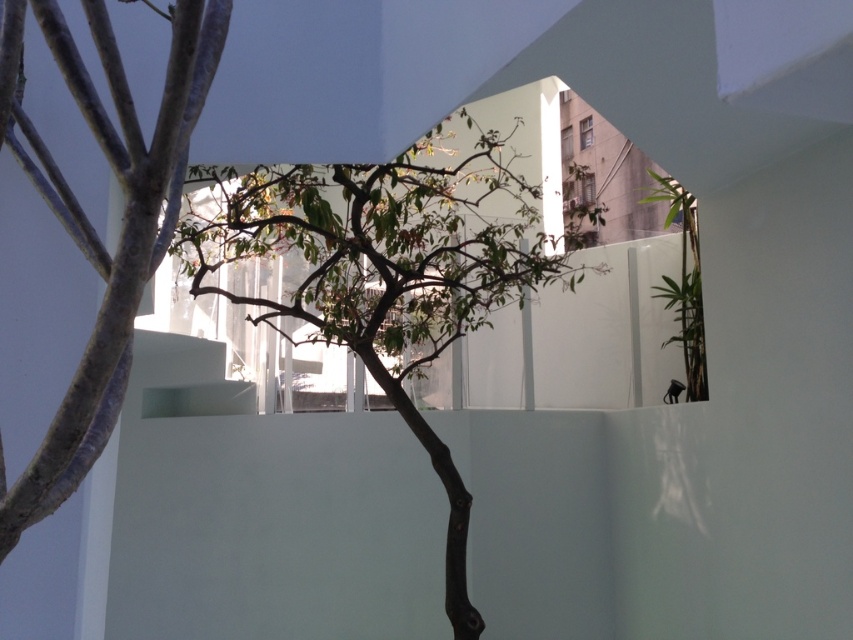
Who is more forward, (225,237) or (695,240)?

Point (225,237) is more forward.

You are a GUI agent. You are given a task and a screenshot of the screen. Output one action in this format:
    pyautogui.click(x=<x>, y=<y>)
    Task: Click on the green leafy tree at center
    The width and height of the screenshot is (853, 640).
    Given the screenshot: What is the action you would take?
    pyautogui.click(x=383, y=273)

Is green leafy tree at left wider than green leafy plant at right?

Indeed, green leafy tree at left has a greater width compared to green leafy plant at right.

Measure the distance between point [178,173] and camera.

A distance of 2.49 meters exists between point [178,173] and camera.

You are a GUI agent. You are given a task and a screenshot of the screen. Output one action in this format:
    pyautogui.click(x=<x>, y=<y>)
    Task: Click on the green leafy tree at left
    This screenshot has width=853, height=640.
    Given the screenshot: What is the action you would take?
    pyautogui.click(x=91, y=225)

Can you confirm if green leafy tree at center is positioned above green leafy tree at left?

Incorrect, green leafy tree at center is not positioned above green leafy tree at left.

Can you confirm if green leafy tree at center is bigger than green leafy tree at left?

Correct, green leafy tree at center is larger in size than green leafy tree at left.

You are a GUI agent. You are given a task and a screenshot of the screen. Output one action in this format:
    pyautogui.click(x=<x>, y=<y>)
    Task: Click on the green leafy tree at center
    The width and height of the screenshot is (853, 640).
    Given the screenshot: What is the action you would take?
    pyautogui.click(x=383, y=273)

Where is `green leafy tree at center`? green leafy tree at center is located at coordinates (383, 273).